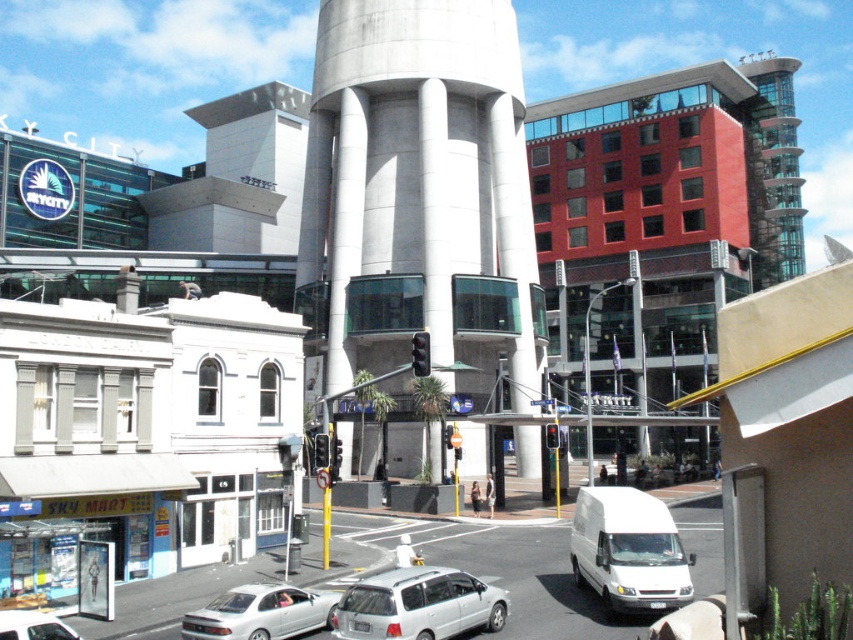
Between white matte van at lower right and silver metallic van at center, which one has less height?

silver metallic van at center

Can you confirm if white matte van at lower right is positioned above silver metallic van at center?

Incorrect, white matte van at lower right is not positioned above silver metallic van at center.

Which is in front, point (619, 612) or point (364, 588)?

Point (364, 588) is more forward.

The height and width of the screenshot is (640, 853). Identify the location of white matte van at lower right. (628, 550).

Which is behind, point (601, 531) or point (0, 628)?

Positioned behind is point (601, 531).

Can you confirm if white matte van at lower right is positioned below silver metallic sedan at lower left?

Yes.

This screenshot has width=853, height=640. In order to click on white matte van at lower right in this screenshot , I will do `click(628, 550)`.

Is silver metallic van at center shorter than silver metallic sedan at lower center?

In fact, silver metallic van at center may be taller than silver metallic sedan at lower center.

Who is positioned more to the right, silver metallic van at center or silver metallic sedan at lower center?

silver metallic van at center is more to the right.

This screenshot has width=853, height=640. Find the location of `silver metallic van at center`. silver metallic van at center is located at coordinates (418, 605).